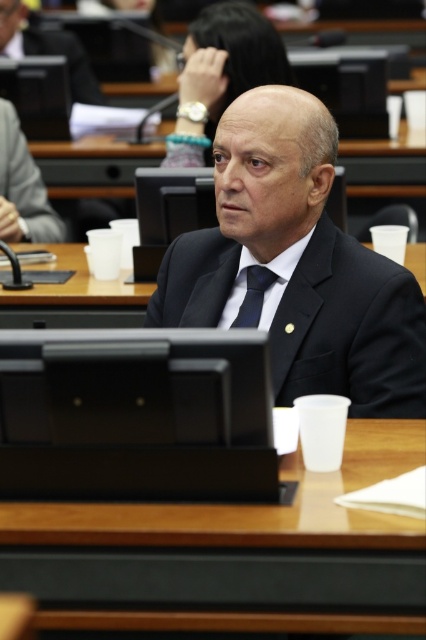
You are organizing a meeting and need to place a 20 cm wide document on the desk. Given the wooden table at center and the matte black suit at center, which object can accommodate the document?

→ The wooden table at center is larger in size than the matte black suit at center, so the document can be placed on the wooden table at center.

You are standing in the conference room and need to find the matte black suit at center. According to the coordinates provided, where exactly is it positioned?

The matte black suit at center is located at point 0.294 on the x axis and 0.054 on the y axis.